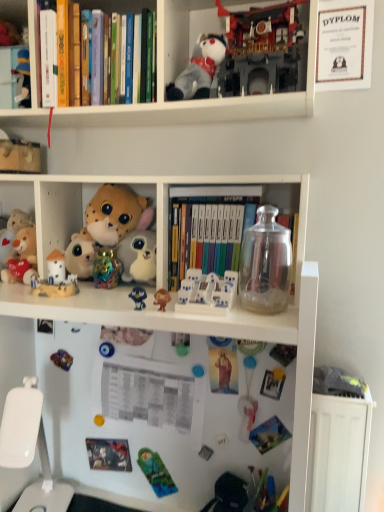
Question: Is white matte bookshelf at upper center thinner than transparent glass jar at upper right?

Choices:
 (A) no
 (B) yes

Answer: (A)

Question: From the image's perspective, would you say white matte bookshelf at upper center is shown under transparent glass jar at upper right?

Choices:
 (A) no
 (B) yes

Answer: (A)

Question: Is white matte bookshelf at upper center in front of transparent glass jar at upper right?

Choices:
 (A) yes
 (B) no

Answer: (A)

Question: Considering the relative sizes of white matte bookshelf at upper center and transparent glass jar at upper right in the image provided, is white matte bookshelf at upper center smaller than transparent glass jar at upper right?

Choices:
 (A) no
 (B) yes

Answer: (A)

Question: Can you confirm if white matte bookshelf at upper center is wider than transparent glass jar at upper right?

Choices:
 (A) no
 (B) yes

Answer: (B)

Question: From a real-world perspective, is white matte bookshelf at upper center physically below transparent glass jar at upper right?

Choices:
 (A) yes
 (B) no

Answer: (B)

Question: Is white plastic toy at center, which is the fourth toy in bottom-to-top order, shorter than fluffy gray stuffed toy at upper center, the 9th toy from the bottom?

Choices:
 (A) no
 (B) yes

Answer: (B)

Question: Could you tell me if white plastic toy at center, which appears as the 7th toy when viewed from the top, is facing fluffy gray stuffed toy at upper center, the 9th toy from the bottom?

Choices:
 (A) yes
 (B) no

Answer: (B)

Question: Does white plastic toy at center, which appears as the 7th toy when viewed from the top, have a lesser width compared to fluffy gray stuffed toy at upper center, the 9th toy from the bottom?

Choices:
 (A) yes
 (B) no

Answer: (B)

Question: Does white plastic toy at center, which is the fourth toy in bottom-to-top order, have a greater width compared to fluffy gray stuffed toy at upper center, the 9th toy from the bottom?

Choices:
 (A) no
 (B) yes

Answer: (B)

Question: Is fluffy gray stuffed toy at upper center, marked as the 2th toy in a top-to-bottom arrangement, located within white plastic toy at center, which appears as the 7th toy when viewed from the top?

Choices:
 (A) yes
 (B) no

Answer: (B)

Question: Is there a large distance between white plastic toy at center, which is the fourth toy in bottom-to-top order, and fluffy gray stuffed toy at upper center, marked as the 2th toy in a top-to-bottom arrangement?

Choices:
 (A) yes
 (B) no

Answer: (B)

Question: Could you tell me if white plastic swivel chair at lower left is facing soft plush toy at center, which ranks as the 4th toy in top-to-bottom order?

Choices:
 (A) yes
 (B) no

Answer: (B)